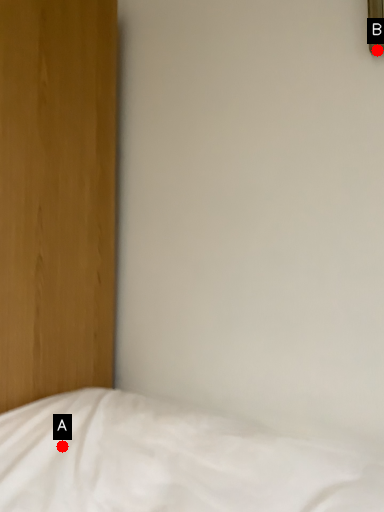
Question: Two points are circled on the image, labeled by A and B beside each circle. Among these points, which one is nearest to the camera?

Choices:
 (A) A is closer
 (B) B is closer

Answer: (A)